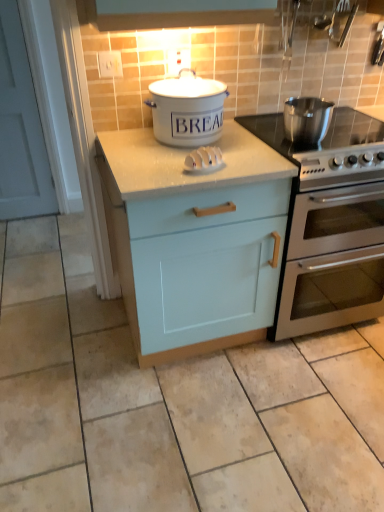
You are a GUI agent. You are given a task and a screenshot of the screen. Output one action in this format:
    pyautogui.click(x=<x>, y=<y>)
    Task: Click on the free spot to the right of white plastic knife block at center
    The width and height of the screenshot is (384, 512).
    Given the screenshot: What is the action you would take?
    pyautogui.click(x=245, y=165)